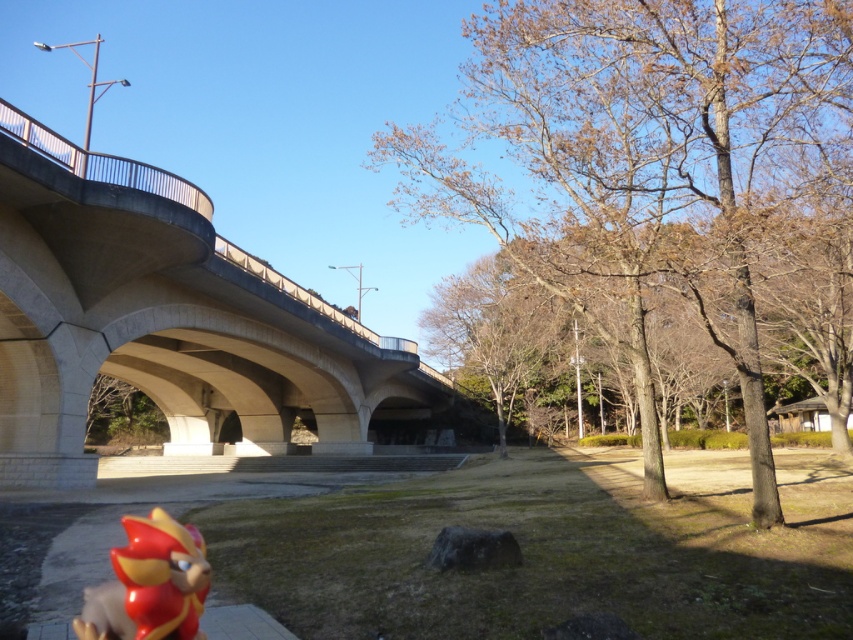
You are a child who wants to place a small toy on the ground near the shiny red plastic toy at lower left. The bare wood tree at center is in the way. Can you move the toy to the spot without moving the tree?

The bare wood tree at center is larger than the shiny red plastic toy at lower left, so it might block access to the desired spot. You might need to find another location or adjust your approach to place the toy near the shiny red plastic toy at lower left without moving the tree.

You are standing at the base of the bridge and want to place a small flag at each of the two points marked in the image. The first point is at coordinate point (728,3) and the second is at point (132,624). Which point is closer to you so that I can place the flag first?

Point (728,3) is closer to you than point (132,624), so place the flag there first.